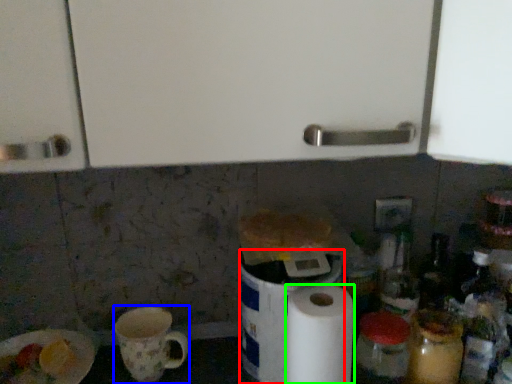
Question: Considering the real-world distances, which object is farthest from appliance (highlighted by a red box)? mug (highlighted by a blue box) or paper towel (highlighted by a green box)?

Choices:
 (A) mug
 (B) paper towel

Answer: (A)